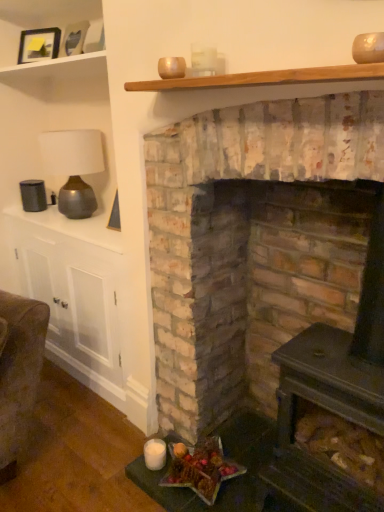
Identify the location of vacant region below matte brown lamp at upper left (from a real-world perspective). (69, 221).